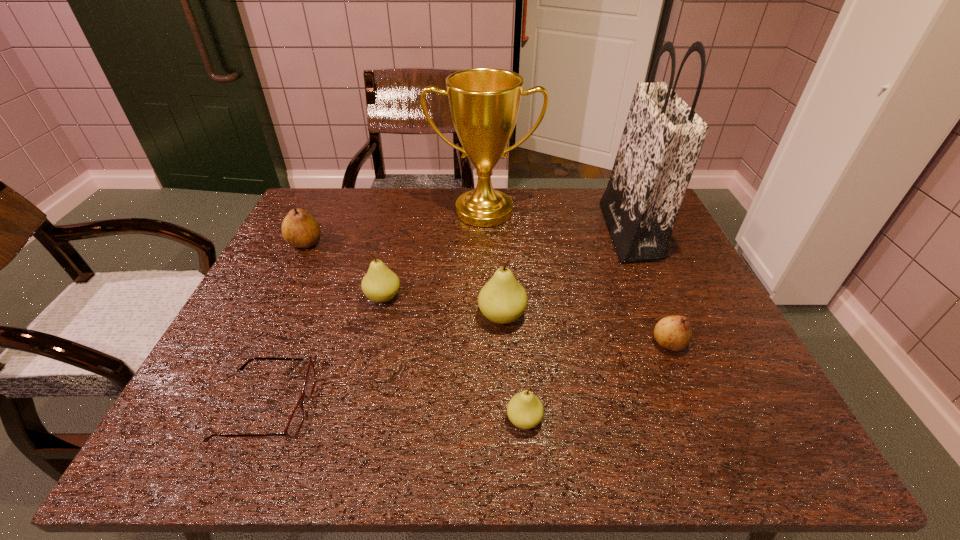
You are a GUI agent. You are given a task and a screenshot of the screen. Output one action in this format:
    pyautogui.click(x=<x>, y=<y>)
    Task: Click on the shopping bag
    The image size is (960, 540).
    Given the screenshot: What is the action you would take?
    pyautogui.click(x=662, y=139)

The image size is (960, 540). I want to click on the seventh shortest object, so click(484, 103).

Locate an element on the screen. gold award is located at coordinates (484, 103).

Locate an element on the screen. This screenshot has height=540, width=960. the third tallest object is located at coordinates (502, 300).

I want to click on the biggest green pear, so click(x=502, y=300).

At what (x,y) coordinates should I click in order to perform the action: click on the farthest pear. Please return your answer as a coordinate pair (x, y). Looking at the image, I should click on (299, 229).

At what (x,y) coordinates should I click in order to perform the action: click on the leftmost pear. Please return your answer as a coordinate pair (x, y). Looking at the image, I should click on (299, 229).

Locate an element on the screen. the leftmost green pear is located at coordinates (380, 284).

Identify the location of the fourth pear from right to left. (380, 284).

This screenshot has width=960, height=540. In order to click on the right brown pear in this screenshot , I will do `click(674, 333)`.